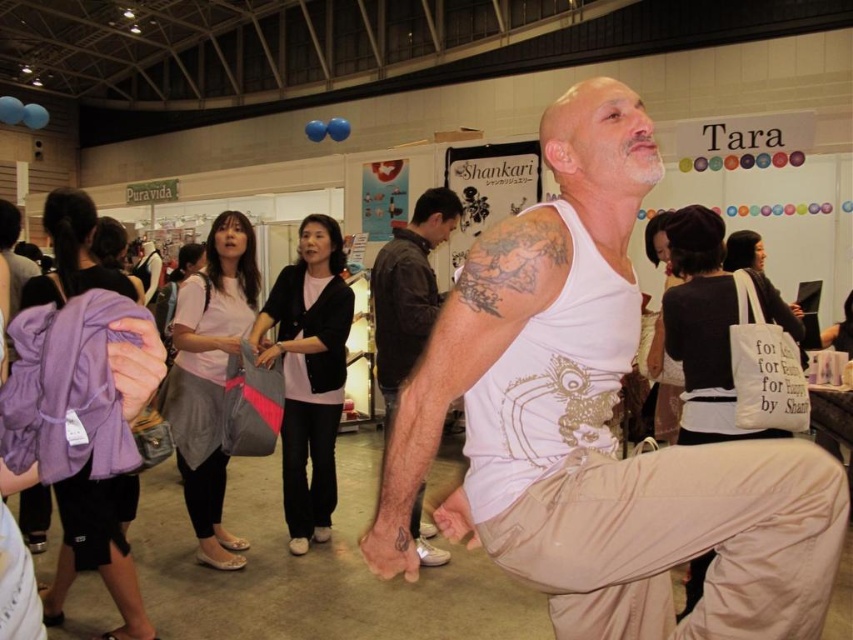
What object is located at the coordinates point (596, 426)?

The point (596, 426) indicates the white matte tank top at center.

You are organizing a clothing swap event and need to know which item is bigger between the white matte tank top at center and the hairy skin tattoo at center. Which one is larger?

The white matte tank top at center has a larger size compared to the hairy skin tattoo at center, so the white matte tank top at center is bigger.

You are a photographer at the event and need to capture a closeup of both the white matte tank top at center and the hairy skin tattoo at center. Given that your camera has a fixed focus area, which object should you prioritize to ensure both are in frame?

The white matte tank top at center is wider than the hairy skin tattoo at center, so prioritizing the white matte tank top at center would allow both to fit within the camera focus area since it covers more space.